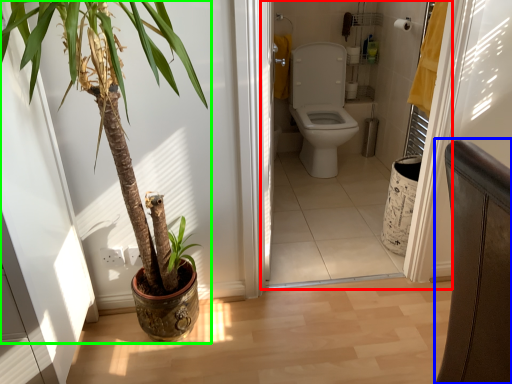
Question: Based on their relative distances, which object is farther from corridor (highlighted by a red box)? Choose from chair (highlighted by a blue box) and houseplant (highlighted by a green box).

Choices:
 (A) chair
 (B) houseplant

Answer: (A)